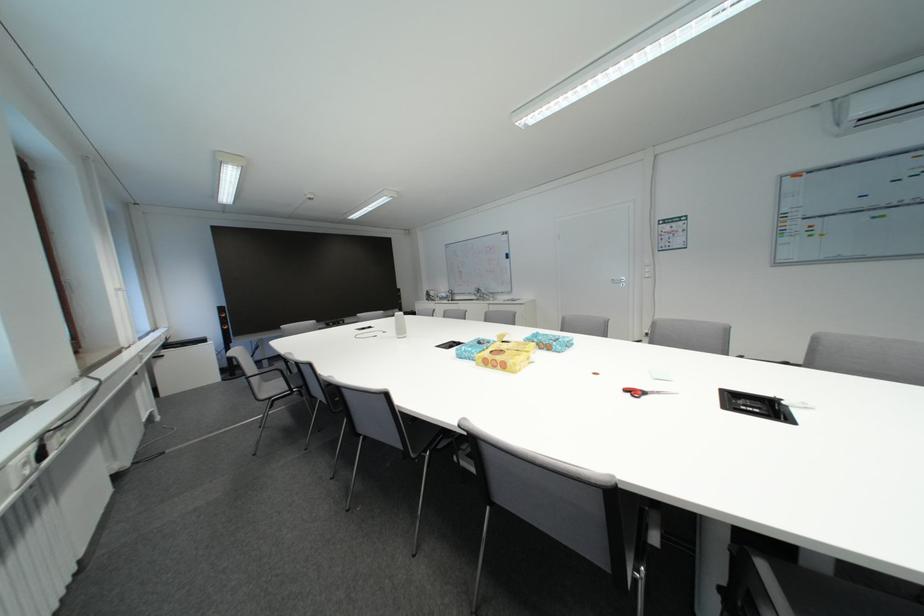
Find the location of a particular element. The height and width of the screenshot is (616, 924). black outlet cover is located at coordinates (756, 406).